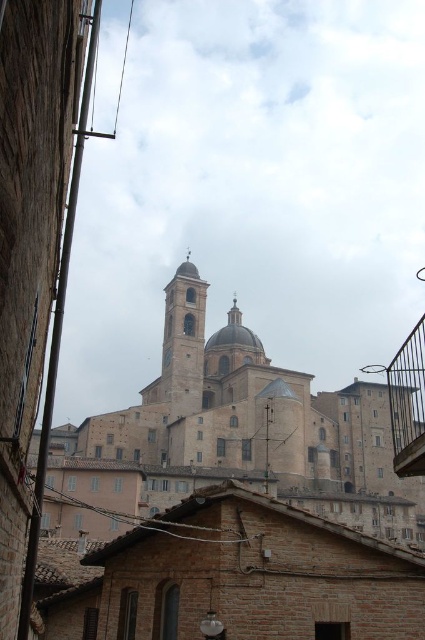
Question: Does smooth stone tower at center have a lesser width compared to metallic balcony at lower right?

Choices:
 (A) no
 (B) yes

Answer: (B)

Question: Can you confirm if smooth stone tower at center is bigger than metallic balcony at lower right?

Choices:
 (A) yes
 (B) no

Answer: (B)

Question: Is smooth stone tower at center thinner than metallic balcony at lower right?

Choices:
 (A) no
 (B) yes

Answer: (B)